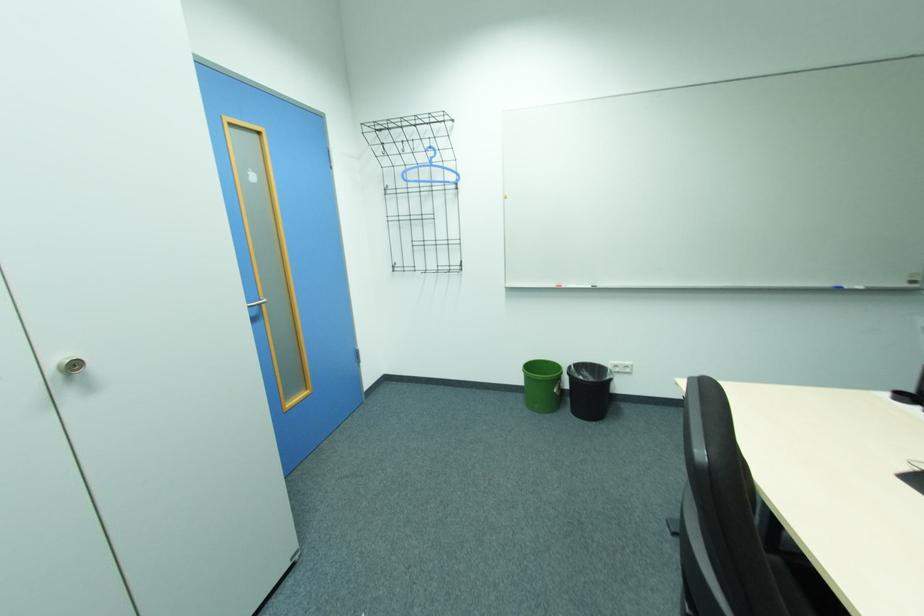
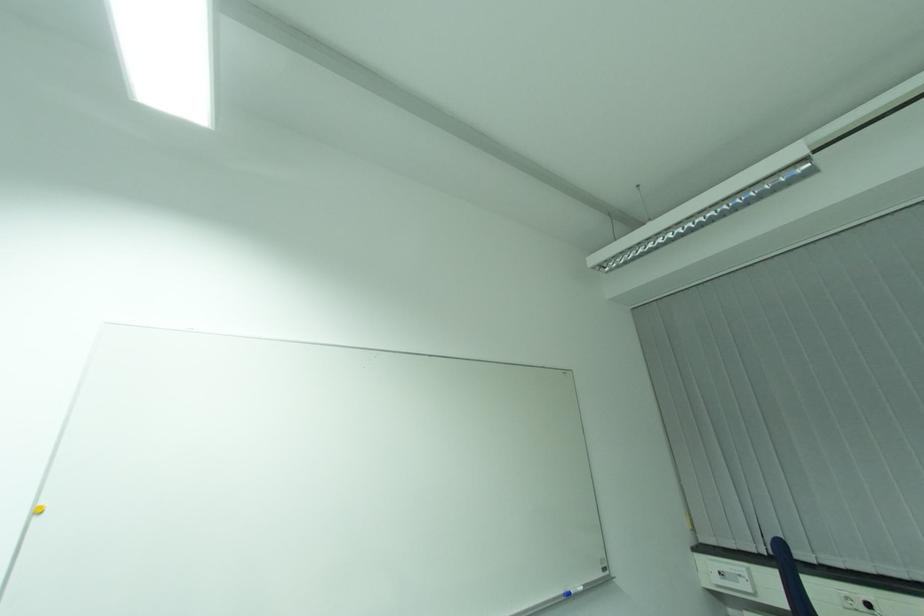
The images are taken continuously from a first-person perspective. In which direction is your viewpoint rotating?

The camera rotated toward right-up.